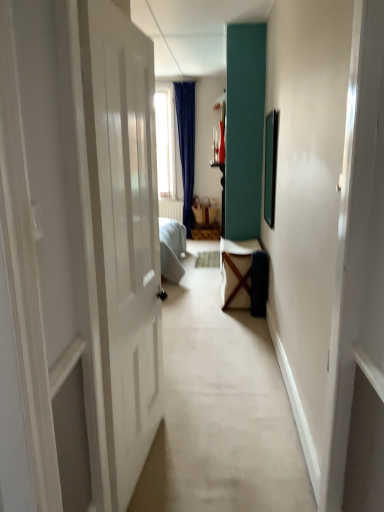
This screenshot has height=512, width=384. What do you see at coordinates (237, 272) in the screenshot? I see `wooden chair at center, which is the second furniture from back to front` at bounding box center [237, 272].

Identify the location of wooden chair at center, which is the second furniture from back to front. The image size is (384, 512). (237, 272).

The height and width of the screenshot is (512, 384). What do you see at coordinates (205, 220) in the screenshot? I see `brown woven basket at center, the second furniture from the bottom` at bounding box center [205, 220].

I want to click on brown woven basket at center, which appears as the second furniture when viewed from the front, so click(x=205, y=220).

Image resolution: width=384 pixels, height=512 pixels. I want to click on wooden chair at center, which is the second furniture from back to front, so click(237, 272).

Is wooden chair at center, the 2th furniture in the top-to-bottom sequence, at the left side of brown woven basket at center, which appears as the second furniture when viewed from the front?

In fact, wooden chair at center, the 2th furniture in the top-to-bottom sequence, is to the right of brown woven basket at center, which appears as the second furniture when viewed from the front.

Is wooden chair at center, the first furniture positioned from the bottom, further to camera compared to brown woven basket at center, which appears as the second furniture when viewed from the front?

No, the depth of wooden chair at center, the first furniture positioned from the bottom, is less than that of brown woven basket at center, which appears as the second furniture when viewed from the front.

Between point (238, 267) and point (212, 224), which one is positioned in front?

Point (238, 267)

From the image's perspective, which one is positioned lower, wooden chair at center, which is the second furniture from back to front, or brown woven basket at center, acting as the first furniture starting from the back?

From the image's view, wooden chair at center, which is the second furniture from back to front, is below.

In the scene shown: From a real-world perspective, which is physically above, wooden chair at center, which is the second furniture from back to front, or brown woven basket at center, which appears as the second furniture when viewed from the front?

From a 3D spatial view, brown woven basket at center, which appears as the second furniture when viewed from the front, is above.

Based on the photo, does wooden chair at center, which is the second furniture from back to front, have a lesser width compared to brown woven basket at center, acting as the first furniture starting from the back?

Incorrect, the width of wooden chair at center, which is the second furniture from back to front, is not less than that of brown woven basket at center, acting as the first furniture starting from the back.

Which of these two, wooden chair at center, which is the second furniture from back to front, or brown woven basket at center, acting as the first furniture starting from the back, stands taller?

Standing taller between the two is wooden chair at center, which is the second furniture from back to front.

Which of these two, wooden chair at center, marked as the 1th furniture in a front-to-back arrangement, or brown woven basket at center, the second furniture from the bottom, is smaller?

Smaller between the two is brown woven basket at center, the second furniture from the bottom.

Could brown woven basket at center, which appears as the second furniture when viewed from the front, be considered to be inside wooden chair at center, which is the second furniture from back to front?

No, brown woven basket at center, which appears as the second furniture when viewed from the front, is not inside wooden chair at center, which is the second furniture from back to front.

Is wooden chair at center, the 2th furniture in the top-to-bottom sequence, with brown woven basket at center, which appears as the second furniture when viewed from the front?

No, wooden chair at center, the 2th furniture in the top-to-bottom sequence, is not making contact with brown woven basket at center, which appears as the second furniture when viewed from the front.

Is wooden chair at center, the first furniture positioned from the bottom, looking in the opposite direction of brown woven basket at center, acting as the first furniture starting from the back?

No, wooden chair at center, the first furniture positioned from the bottom, is not facing the opposite direction of brown woven basket at center, acting as the first furniture starting from the back.

What's the angular difference between wooden chair at center, the first furniture positioned from the bottom, and brown woven basket at center, which appears as the second furniture when viewed from the front,'s facing directions?

90 degrees separate the facing orientations of wooden chair at center, the first furniture positioned from the bottom, and brown woven basket at center, which appears as the second furniture when viewed from the front.

At what (x,y) coordinates should I click in order to perform the action: click on furniture on the right side of brown woven basket at center, which is the first furniture in top-to-bottom order. Please return your answer as a coordinate pair (x, y). Looking at the image, I should click on (237, 272).

Which object is positioned more to the right, brown woven basket at center, which appears as the second furniture when viewed from the front, or wooden chair at center, marked as the 1th furniture in a front-to-back arrangement?

wooden chair at center, marked as the 1th furniture in a front-to-back arrangement.

Relative to wooden chair at center, the 2th furniture in the top-to-bottom sequence, is brown woven basket at center, the second furniture from the bottom, in front or behind?

brown woven basket at center, the second furniture from the bottom, is behind wooden chair at center, the 2th furniture in the top-to-bottom sequence.

Is point (211, 212) in front of point (229, 282)?

No, it is behind (229, 282).

From the image's perspective, relative to wooden chair at center, the first furniture positioned from the bottom, is brown woven basket at center, which appears as the second furniture when viewed from the front, above or below?

Clearly, from the image's perspective, brown woven basket at center, which appears as the second furniture when viewed from the front, is above wooden chair at center, the first furniture positioned from the bottom.

From a real-world perspective, between brown woven basket at center, which is the first furniture in top-to-bottom order, and wooden chair at center, marked as the 1th furniture in a front-to-back arrangement, who is vertically lower?

From a 3D spatial view, wooden chair at center, marked as the 1th furniture in a front-to-back arrangement, is below.

Can you confirm if brown woven basket at center, the second furniture from the bottom, is thinner than wooden chair at center, marked as the 1th furniture in a front-to-back arrangement?

Indeed, brown woven basket at center, the second furniture from the bottom, has a lesser width compared to wooden chair at center, marked as the 1th furniture in a front-to-back arrangement.

In terms of height, does brown woven basket at center, which appears as the second furniture when viewed from the front, look taller or shorter compared to wooden chair at center, the first furniture positioned from the bottom?

Clearly, brown woven basket at center, which appears as the second furniture when viewed from the front, is shorter compared to wooden chair at center, the first furniture positioned from the bottom.

Is brown woven basket at center, the second furniture from the bottom, bigger or smaller than wooden chair at center, marked as the 1th furniture in a front-to-back arrangement?

In the image, brown woven basket at center, the second furniture from the bottom, appears to be smaller than wooden chair at center, marked as the 1th furniture in a front-to-back arrangement.

Is wooden chair at center, which is the second furniture from back to front, surrounded by brown woven basket at center, which is the first furniture in top-to-bottom order?

No, wooden chair at center, which is the second furniture from back to front, is not inside brown woven basket at center, which is the first furniture in top-to-bottom order.

Is brown woven basket at center, which is the first furniture in top-to-bottom order, next to wooden chair at center, marked as the 1th furniture in a front-to-back arrangement?

No, brown woven basket at center, which is the first furniture in top-to-bottom order, is not making contact with wooden chair at center, marked as the 1th furniture in a front-to-back arrangement.

Based on the photo, is brown woven basket at center, acting as the first furniture starting from the back, oriented away from wooden chair at center, the 2th furniture in the top-to-bottom sequence?

brown woven basket at center, acting as the first furniture starting from the back, is not turned away from wooden chair at center, the 2th furniture in the top-to-bottom sequence.

How many degrees apart are the facing directions of brown woven basket at center, which appears as the second furniture when viewed from the front, and wooden chair at center, the first furniture positioned from the bottom?

There is a 90-degree angle between the facing directions of brown woven basket at center, which appears as the second furniture when viewed from the front, and wooden chair at center, the first furniture positioned from the bottom.

How much distance is there between brown woven basket at center, which is the first furniture in top-to-bottom order, and wooden chair at center, marked as the 1th furniture in a front-to-back arrangement?

brown woven basket at center, which is the first furniture in top-to-bottom order, and wooden chair at center, marked as the 1th furniture in a front-to-back arrangement, are 8.84 feet apart.

You are a GUI agent. You are given a task and a screenshot of the screen. Output one action in this format:
    pyautogui.click(x=<x>, y=<y>)
    Task: Click on the furniture located behind the wooden chair at center, marked as the 1th furniture in a front-to-back arrangement
    Image resolution: width=384 pixels, height=512 pixels.
    Given the screenshot: What is the action you would take?
    pyautogui.click(x=205, y=220)

Find the location of `furniture in front of the brown woven basket at center, acting as the first furniture starting from the back`. furniture in front of the brown woven basket at center, acting as the first furniture starting from the back is located at coordinates (237, 272).

You are a GUI agent. You are given a task and a screenshot of the screen. Output one action in this format:
    pyautogui.click(x=<x>, y=<y>)
    Task: Click on the furniture directly beneath the brown woven basket at center, acting as the first furniture starting from the back (from a real-world perspective)
    
    Given the screenshot: What is the action you would take?
    pyautogui.click(x=237, y=272)